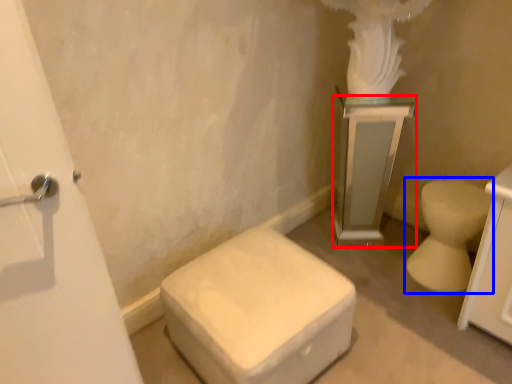
Question: Among these objects, which one is farthest to the camera, medicine cabinet (highlighted by a red box) or toilet (highlighted by a blue box)?

Choices:
 (A) medicine cabinet
 (B) toilet

Answer: (A)